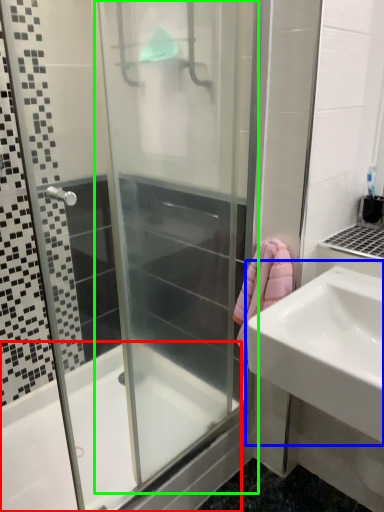
Question: Which object is the closest to the bathtub (highlighted by a red box)? Choose among these: sink (highlighted by a blue box) or screen door (highlighted by a green box).

Choices:
 (A) sink
 (B) screen door

Answer: (B)